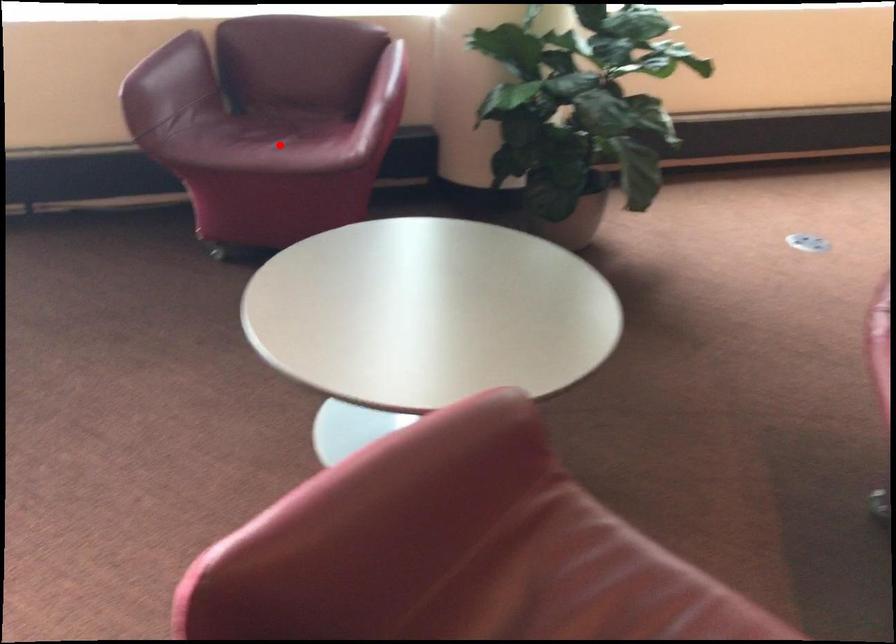
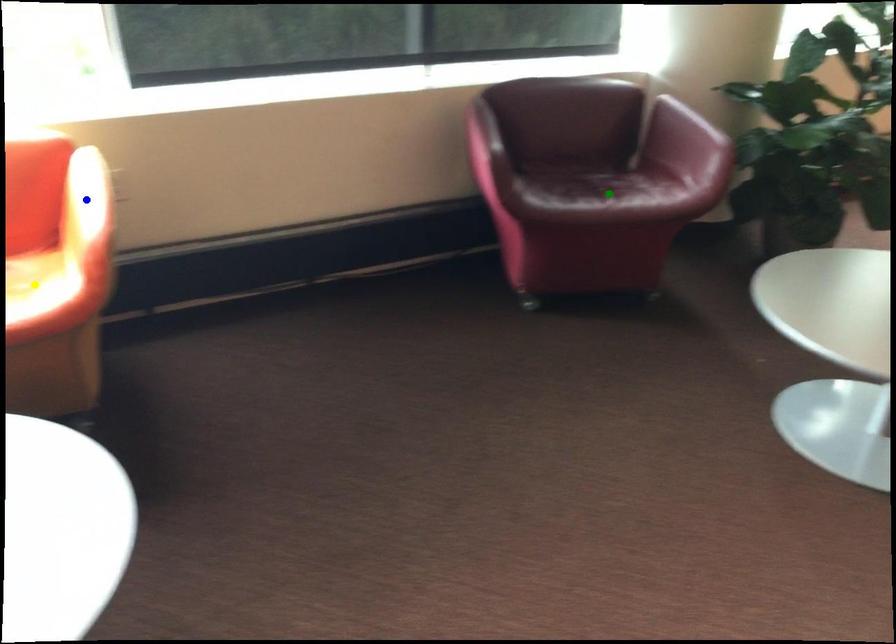
Question: I am providing you with two images of the same scene from different viewpoints. A red point is marked on the first image. You are given multiple points on the second image. Which point in image 2 represents the same 3d spot as the red point in image 1?

Choices:
 (A) blue point
 (B) green point
 (C) yellow point

Answer: (B)